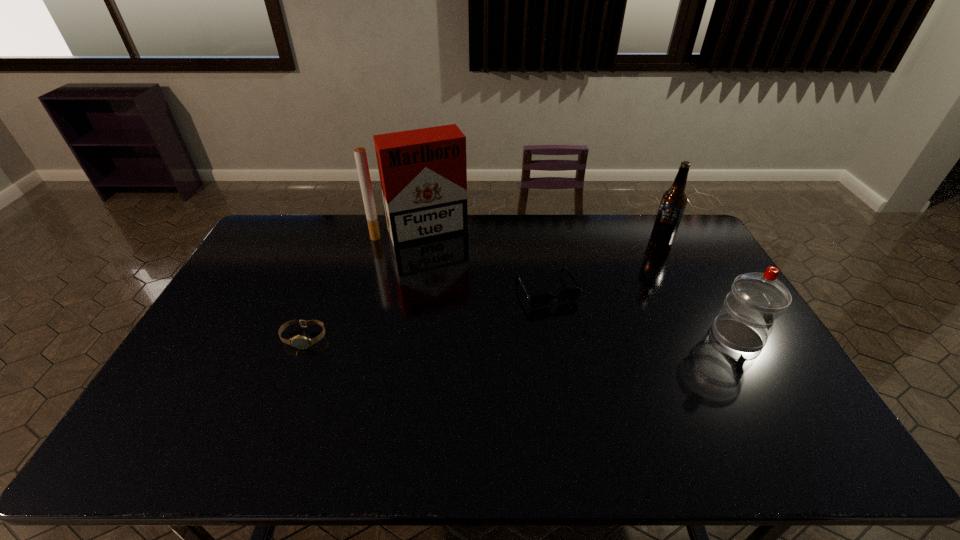
You are a GUI agent. You are given a task and a screenshot of the screen. Output one action in this format:
    pyautogui.click(x=<x>, y=<y>)
    Task: Click on the leftmost object
    The width and height of the screenshot is (960, 540).
    Given the screenshot: What is the action you would take?
    tap(300, 342)

At what (x,y) coordinates should I click in order to perform the action: click on water bottle. Please return your answer as a coordinate pair (x, y). The image size is (960, 540). Looking at the image, I should click on (746, 320).

At what (x,y) coordinates should I click in order to perform the action: click on the second object from left to right. Please return your answer as a coordinate pair (x, y). Looking at the image, I should click on (423, 173).

The image size is (960, 540). I want to click on cigarette case, so click(x=423, y=173).

Find the location of a particular element. This screenshot has width=960, height=540. sunglasses is located at coordinates (545, 299).

Locate an element on the screen. The width and height of the screenshot is (960, 540). the third nearest object is located at coordinates (545, 299).

Locate an element on the screen. The height and width of the screenshot is (540, 960). beer bottle is located at coordinates (673, 202).

Locate an element on the screen. The width and height of the screenshot is (960, 540). blank space located 0.120m on the face of the watch is located at coordinates (285, 385).

You are a GUI agent. You are given a task and a screenshot of the screen. Output one action in this format:
    pyautogui.click(x=<x>, y=<y>)
    Task: Click on the vacant space located on the front-facing side of the cigarette case
    Image resolution: width=960 pixels, height=540 pixels.
    Given the screenshot: What is the action you would take?
    pyautogui.click(x=443, y=264)

The width and height of the screenshot is (960, 540). Identify the location of free space located 0.370m on the front-facing side of the cigarette case. (467, 314).